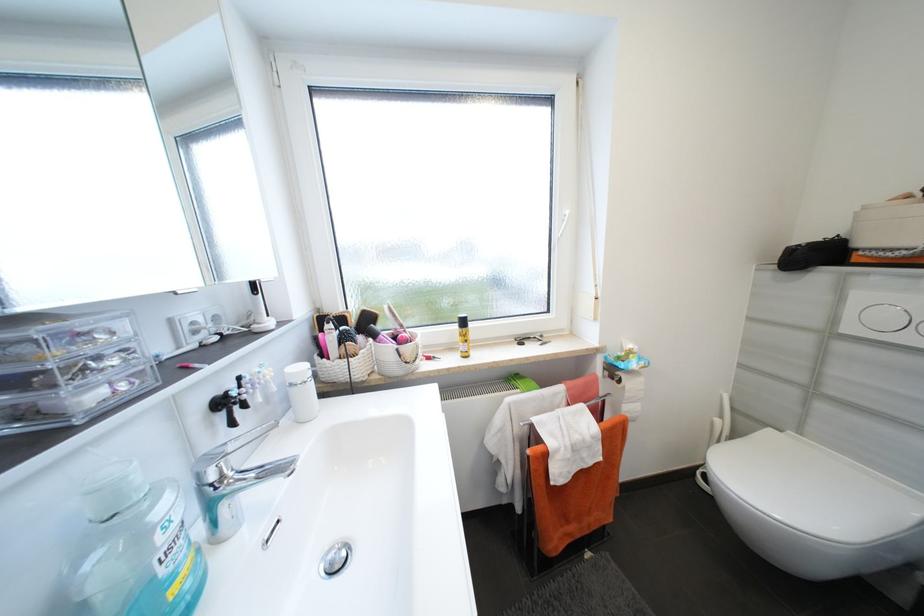
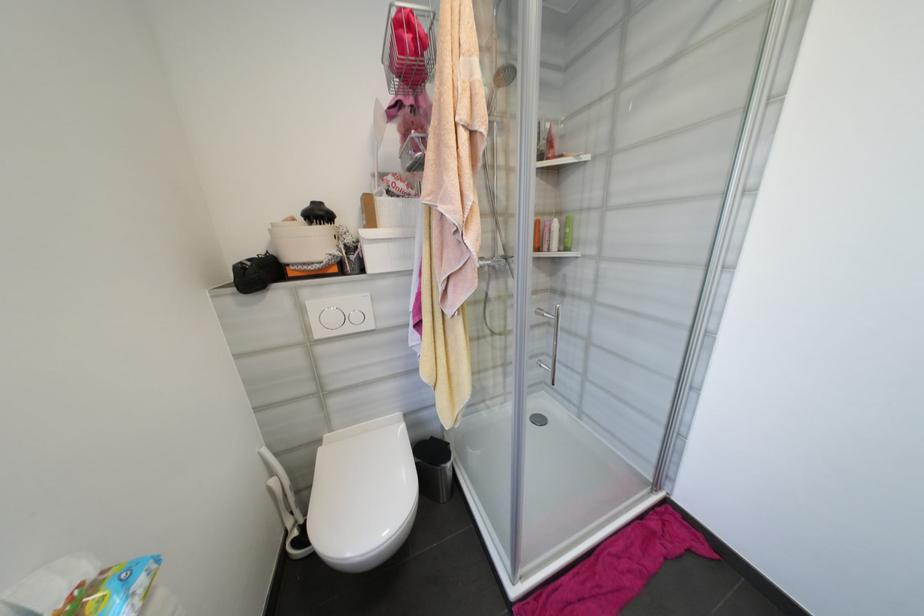
Locate, in the second image, the point that corresponds to pixel 723 421 in the first image.

(277, 482)